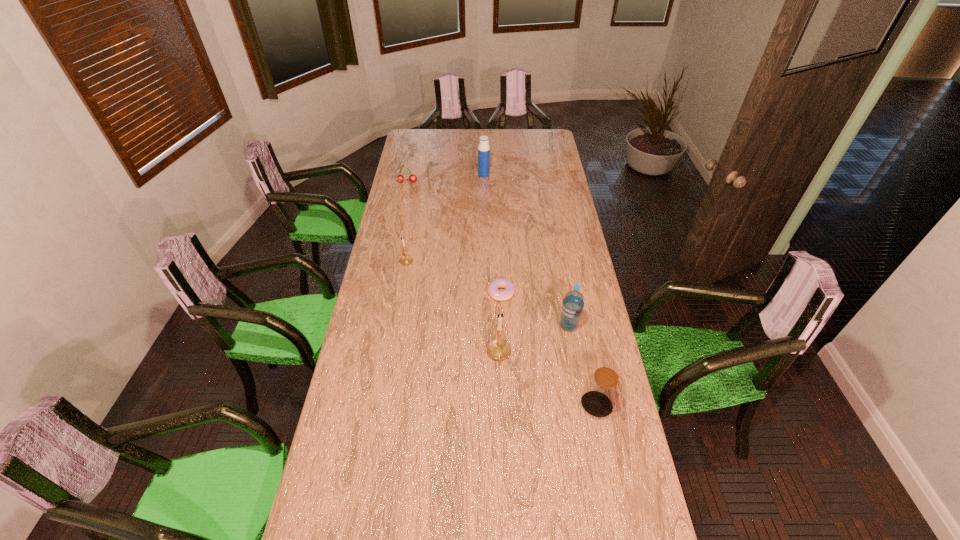
Locate an element on the screen. Image resolution: width=960 pixels, height=540 pixels. free space for a new candle holder on the right is located at coordinates (643, 502).